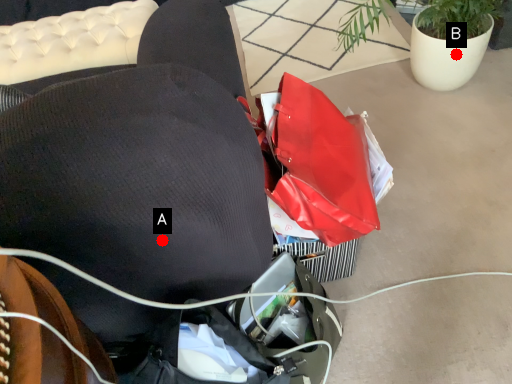
Question: Two points are circled on the image, labeled by A and B beside each circle. Which point is closer to the camera taking this photo?

Choices:
 (A) A is closer
 (B) B is closer

Answer: (A)